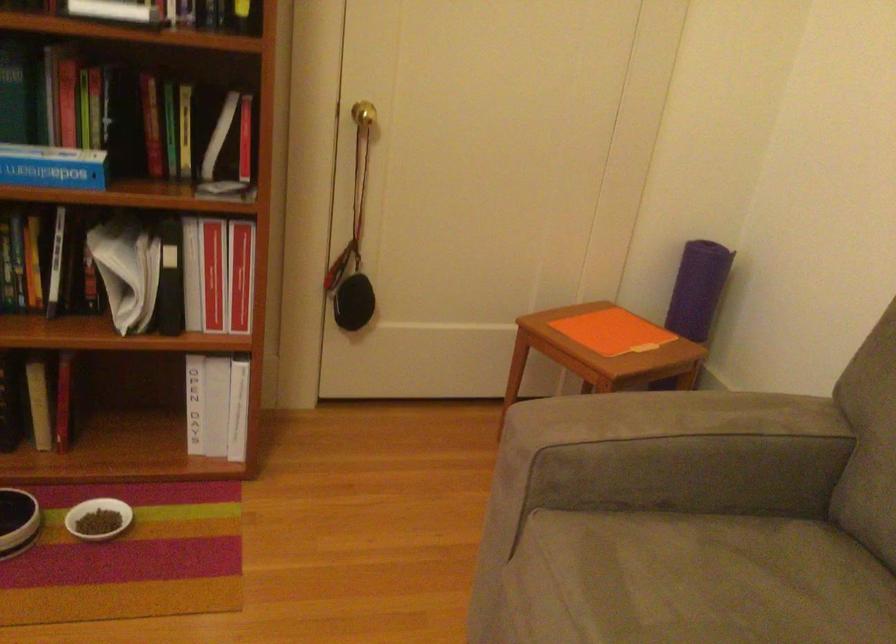
Find where to resting arm the sofa armrest. Please return your answer as a coordinate pair (x, y).

(675, 453)